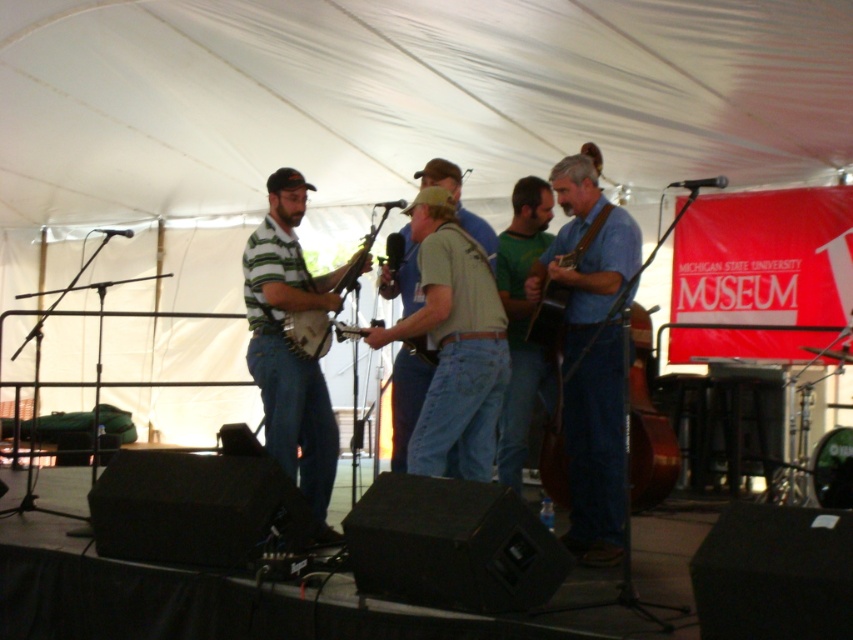
You are a photographer at the music event and want to capture a photo of the blue denim jeans at center and the striped jersey banjo at center. Since you want to highlight the banjo, should you position it closer to the camera or further away from the camera compared to the jeans?

To highlight the striped jersey banjo at center, you should position it closer to the camera than the blue denim jeans at center. Since the blue denim jeans at center is taller than the banjo, placing the banjo closer can make it appear larger in the photo, drawing more attention to it.

You are at an outdoor music event under a large white tent. You see a point marked at coordinates (x=647, y=424). What object is located at that point?

The point at coordinates (x=647, y=424) corresponds to the brown wooden cello at lower right.

You are a stagehand responsible for arranging instruments. You need to place a microphone stand that is 1.5 meters wide between the brown wooden cello at lower right and the wooden banjo at center. Is there enough space to fit the microphone stand between them?

The distance between the brown wooden cello at lower right and the wooden banjo at center is 1.72 meters. Since the microphone stand is 1.5 meters wide, there is sufficient space to place it between them as the available distance exceeds the required width.